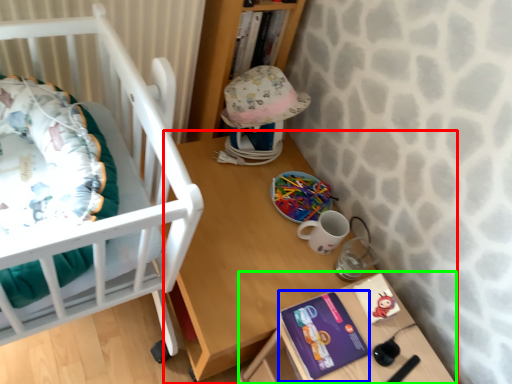
Question: Considering the real-world distances, which object is farthest from table (highlighted by a red box)? paperback book (highlighted by a blue box) or changing table (highlighted by a green box)?

Choices:
 (A) paperback book
 (B) changing table

Answer: (A)